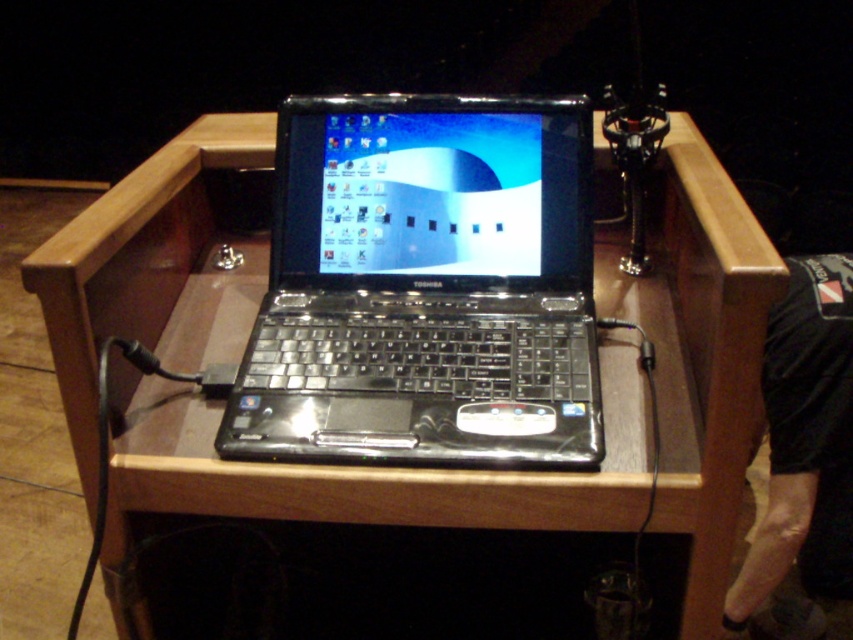
Does black glossy laptop at center have a larger size compared to black fabric at lower right?

Actually, black glossy laptop at center might be smaller than black fabric at lower right.

Between point (384, 106) and point (839, 381), which one is positioned in front?

Point (384, 106) is in front.

In order to click on black glossy laptop at center in this screenshot , I will do `click(425, 288)`.